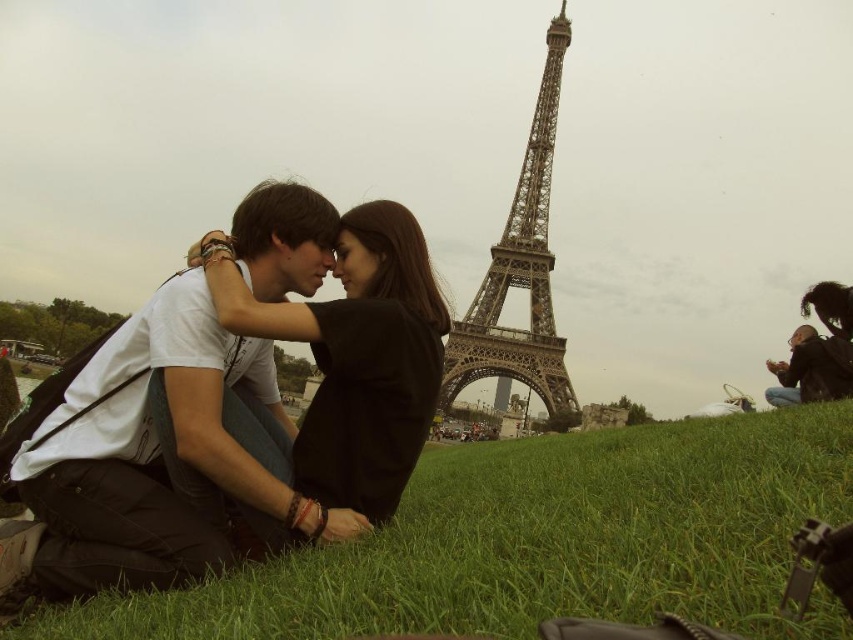
You are a photographer planning to take a portrait of the couple in the scene. The green grassy at lower center and the black matte dress at center are part of the background and foreground elements respectively. Given their distance apart, would you need to adjust the focus to ensure both are in sharp focus simultaneously?

The green grassy at lower center and black matte dress at center are 41.66 meters apart. To have both in sharp focus, the photographer would need to use a small aperture to increase depth of field or adjust the focus point to the hyperfocal distance.

You are standing in front of the Eiffel Tower and see two points marked in the scene. Which point, point (422, 532) or point (397, 234), is closer to you?

Point (422, 532) is closer to the viewer than point (397, 234).

You are a photographer planning to capture the entire scene of the green grassy at lower center and the metallic gray eiffel tower at center in one shot. Given that the camera sensor can only accommodate a maximum width of 10 meters, will both objects fit within the frame?

The green grassy at lower center has a larger width than the metallic gray eiffel tower at center. Since the camera sensor can only accommodate a maximum width of 10 meters, both objects will fit within the frame as long as their combined widths do not exceed 10 meters. However, the exact dimensions are not provided, so this depends on their actual sizes.